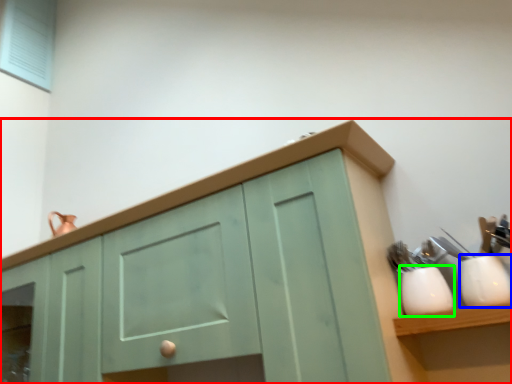
Question: Which object is the closest to the cabinetry (highlighted by a red box)? Choose among these: tableware (highlighted by a blue box) or tableware (highlighted by a green box).

Choices:
 (A) tableware
 (B) tableware

Answer: (B)